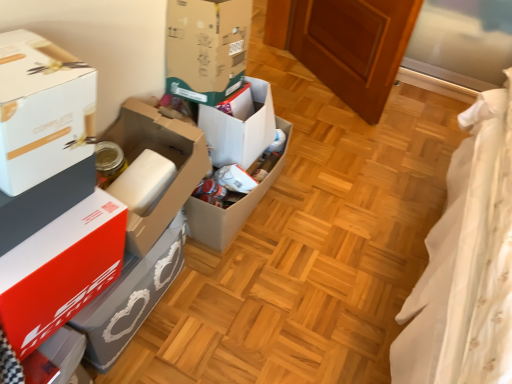
Question: From the image's perspective, is white cardboard box at left, which is counted as the first box, starting from the front, under cardboard box at center, the 4th box from the front?

Choices:
 (A) no
 (B) yes

Answer: (B)

Question: From a real-world perspective, is white cardboard box at left, the sixth box from the back, physically below cardboard box at center, the 4th box from the front?

Choices:
 (A) no
 (B) yes

Answer: (A)

Question: Can you confirm if white cardboard box at left, which is counted as the first box, starting from the front, is thinner than cardboard box at center, the 4th box from the front?

Choices:
 (A) yes
 (B) no

Answer: (A)

Question: Is white cardboard box at left, which is counted as the first box, starting from the front, bigger than cardboard box at center, marked as the third box in a back-to-front arrangement?

Choices:
 (A) yes
 (B) no

Answer: (B)

Question: Are white cardboard box at left, which is counted as the first box, starting from the front, and cardboard box at center, marked as the third box in a back-to-front arrangement, located far from each other?

Choices:
 (A) no
 (B) yes

Answer: (A)

Question: In the image, is white cardboard box at left, positioned as the 3th box in front-to-back order, positioned in front of or behind red matte box at left, the second box in the front-to-back sequence?

Choices:
 (A) behind
 (B) front

Answer: (A)

Question: Considering the positions of white cardboard box at left, positioned as the 3th box in front-to-back order, and red matte box at left, arranged as the 5th box when viewed from the back, in the image, is white cardboard box at left, positioned as the 3th box in front-to-back order, wider or thinner than red matte box at left, arranged as the 5th box when viewed from the back,?

Choices:
 (A) thin
 (B) wide

Answer: (A)

Question: Is point (116, 132) positioned closer to the camera than point (103, 192)?

Choices:
 (A) farther
 (B) closer

Answer: (A)

Question: In terms of size, does white cardboard box at left, which is the 4th box from back to front, appear bigger or smaller than red matte box at left, the second box in the front-to-back sequence?

Choices:
 (A) small
 (B) big

Answer: (A)

Question: Is cardboard box at center, the fifth box when ordered from front to back, inside or outside of cardboard box at center, marked as the third box in a back-to-front arrangement?

Choices:
 (A) outside
 (B) inside

Answer: (A)

Question: Considering the relative positions of cardboard box at center, placed as the second box when sorted from back to front, and cardboard box at center, the 4th box from the front, in the image provided, is cardboard box at center, placed as the second box when sorted from back to front, to the left or to the right of cardboard box at center, the 4th box from the front,?

Choices:
 (A) left
 (B) right

Answer: (B)

Question: In the image, is cardboard box at center, placed as the second box when sorted from back to front, positioned in front of or behind cardboard box at center, marked as the third box in a back-to-front arrangement?

Choices:
 (A) behind
 (B) front

Answer: (A)

Question: Considering the positions of cardboard box at center, the fifth box when ordered from front to back, and cardboard box at center, the 4th box from the front, in the image, is cardboard box at center, the fifth box when ordered from front to back, bigger or smaller than cardboard box at center, the 4th box from the front,?

Choices:
 (A) small
 (B) big

Answer: (B)

Question: From a real-world perspective, relative to white cardboard box at left, positioned as the 3th box in front-to-back order, is cardboard box at center, marked as the third box in a back-to-front arrangement, vertically above or below?

Choices:
 (A) above
 (B) below

Answer: (A)

Question: Considering the positions of cardboard box at center, marked as the third box in a back-to-front arrangement, and white cardboard box at left, which is the 4th box from back to front, in the image, is cardboard box at center, marked as the third box in a back-to-front arrangement, taller or shorter than white cardboard box at left, which is the 4th box from back to front,?

Choices:
 (A) short
 (B) tall

Answer: (B)